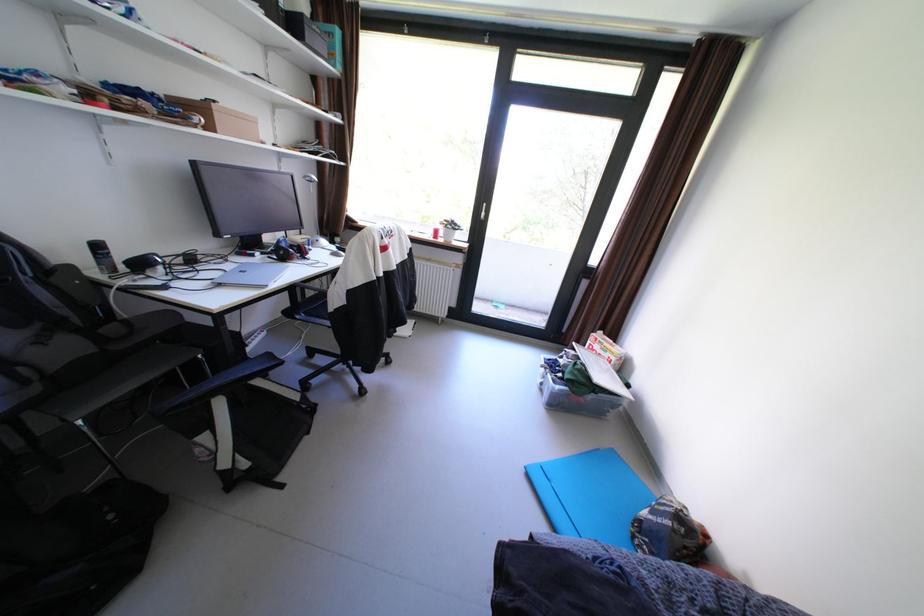
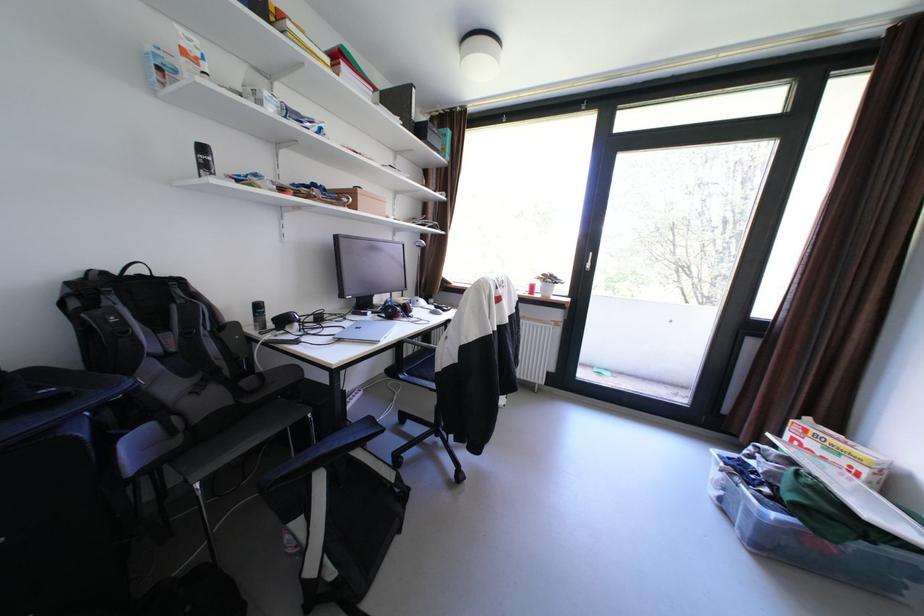
In the scene shown: Which direction would the cameraman need to move to produce the second image?

The movement direction of the cameraman is left, forward.